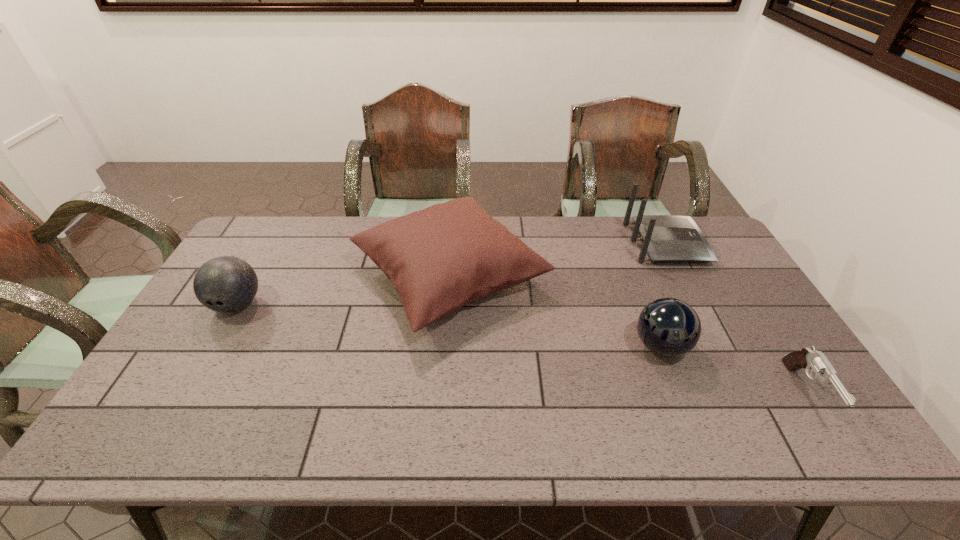
The width and height of the screenshot is (960, 540). Identify the location of free space between the rightmost object and the left bowling ball. (521, 348).

At what (x,y) coordinates should I click in order to perform the action: click on free space that is in between the right bowling ball and the shortest object. Please return your answer as a coordinate pair (x, y). The height and width of the screenshot is (540, 960). Looking at the image, I should click on (733, 369).

Identify which object is located as the fourth nearest to the leftmost object. Please provide its 2D coordinates. Your answer should be formatted as a tuple, i.e. [(x, y)], where the tuple contains the x and y coordinates of a point satisfying the conditions above.

[(807, 358)]

Locate an element on the screen. object that ranks as the fourth closest to the leftmost object is located at coordinates (807, 358).